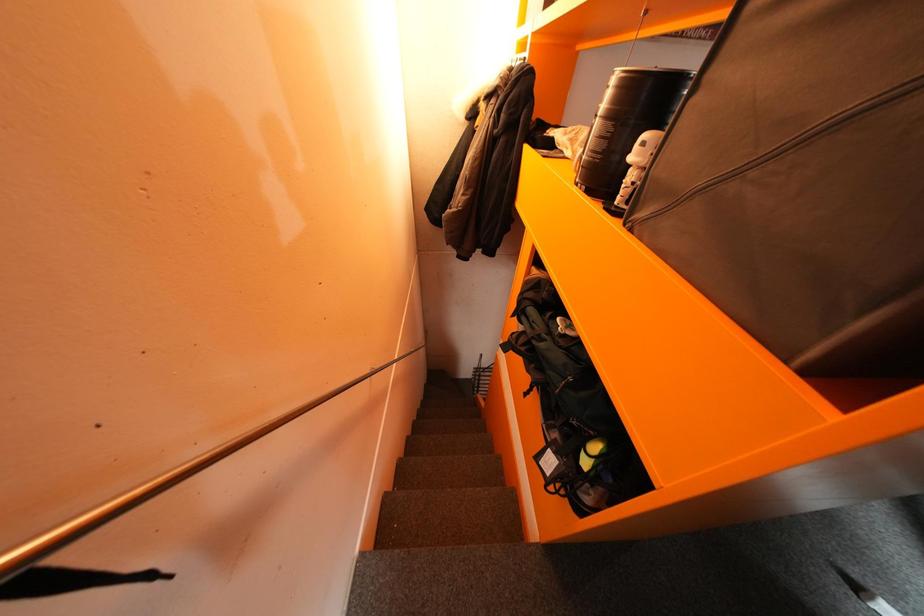
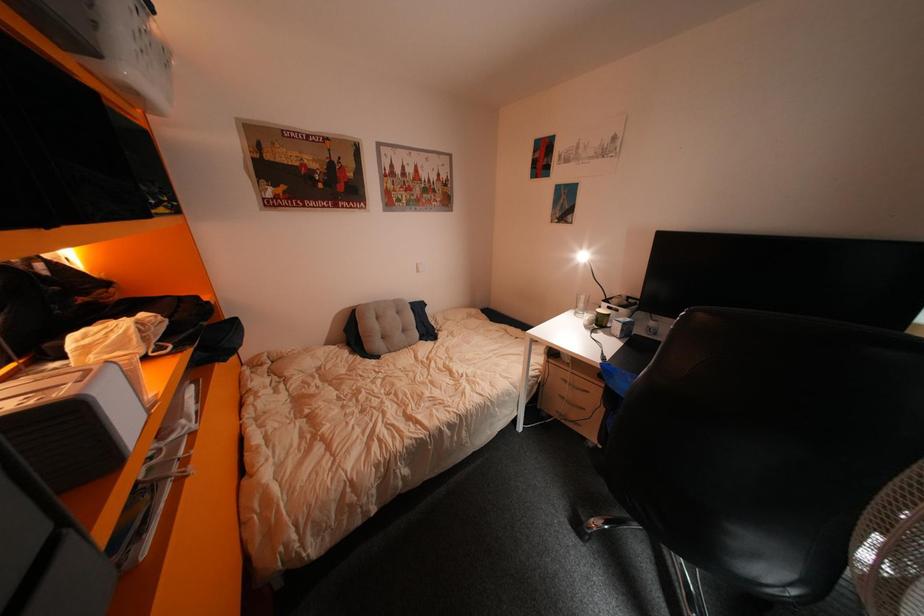
Question: The first image is from the beginning of the video and the second image is from the end. How did the camera likely rotate when shooting the video?

Choices:
 (A) Left
 (B) Right
 (C) Up
 (D) Down

Answer: (B)